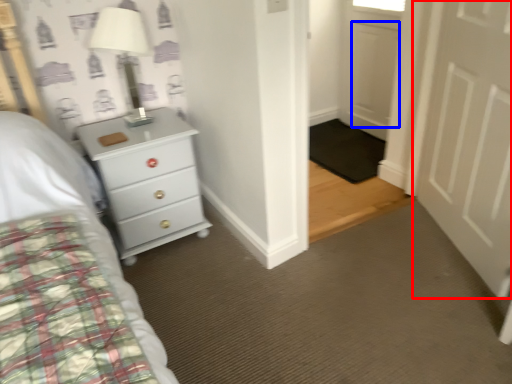
Question: Which of the following is the farthest to the observer, door (highlighted by a red box) or door (highlighted by a blue box)?

Choices:
 (A) door
 (B) door

Answer: (B)